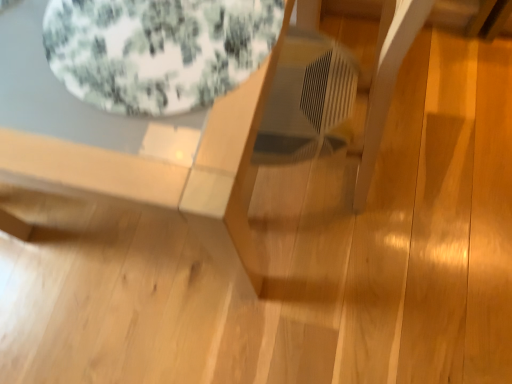
The height and width of the screenshot is (384, 512). I want to click on free space in front of wooden table at center, so click(x=209, y=326).